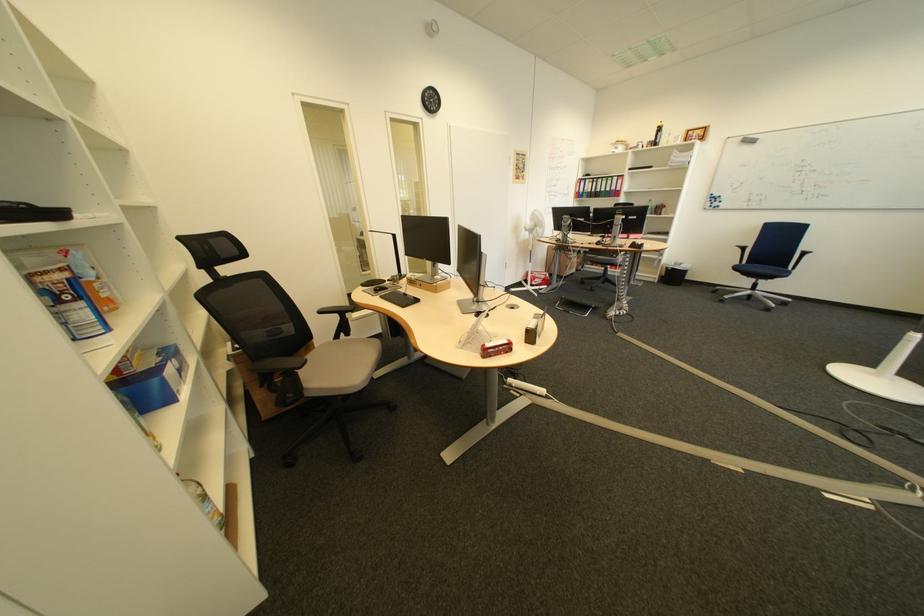
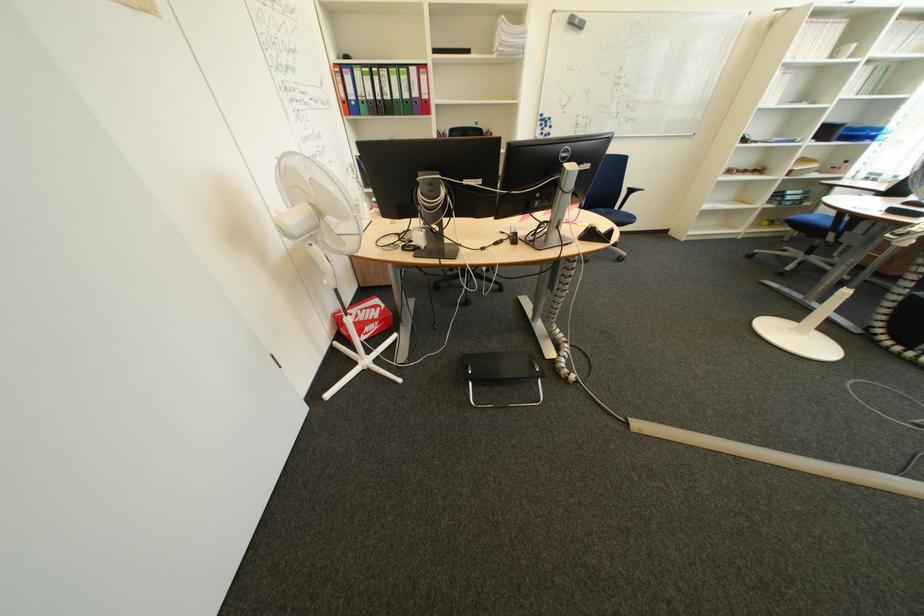
Where in the second image is the point corresponding to point 553,281 from the first image?

(385, 326)